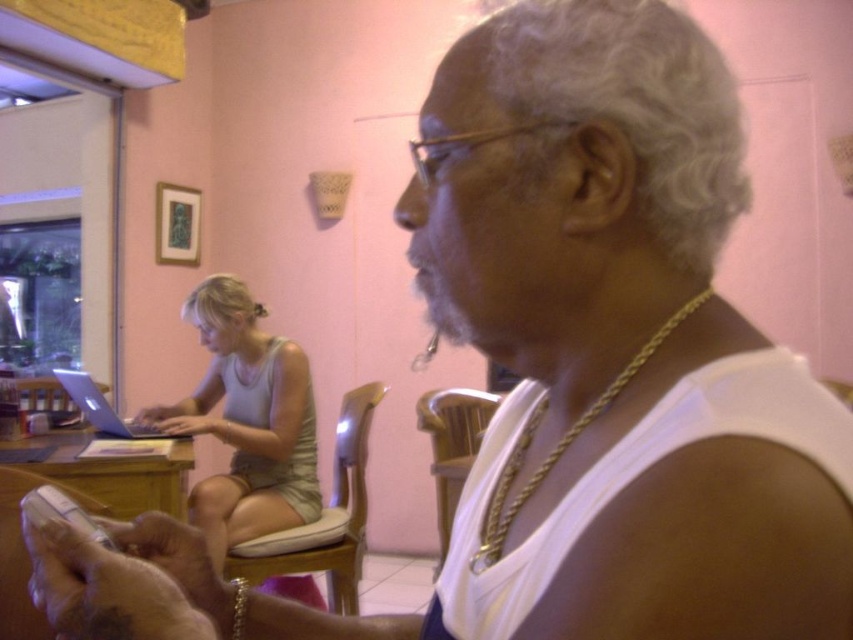
What do you see at coordinates (247, 420) in the screenshot?
I see `light purple tank top at center` at bounding box center [247, 420].

Who is more distant from viewer, (247, 292) or (57, 371)?

The point (57, 371) is behind.

The width and height of the screenshot is (853, 640). I want to click on light purple tank top at center, so click(x=247, y=420).